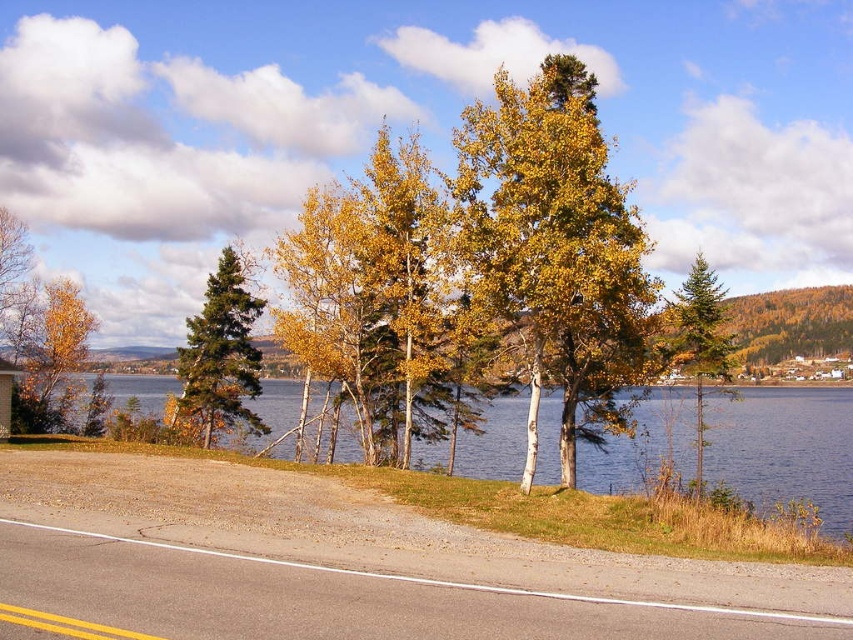
You are a bird flying over the lakeside scene. You want to land on the closest object to you. Which object would you choose between the blue water at center and the green glossy pine tree at left?

The blue water at center is shorter than the green glossy pine tree at left, so the bird should land on the blue water at center because it is closer to the ground.

You are a hiker standing on the lakeside path. You see the golden yellow leaves at left and the green matte evergreen tree at right. Which object is positioned more to the east if the road runs north to south?

The golden yellow leaves at left is positioned more to the east because it is to the left of the green matte evergreen tree at right, and if the road runs north to south, the left side would face east.

You are standing on the lakeside path and want to take a photo of the green glossy pine tree at left and the blue water at center. Which object should be positioned to the left in your photo?

The green glossy pine tree at left should be positioned to the left in your photo since it is located to the left of the blue water at center according to the description.